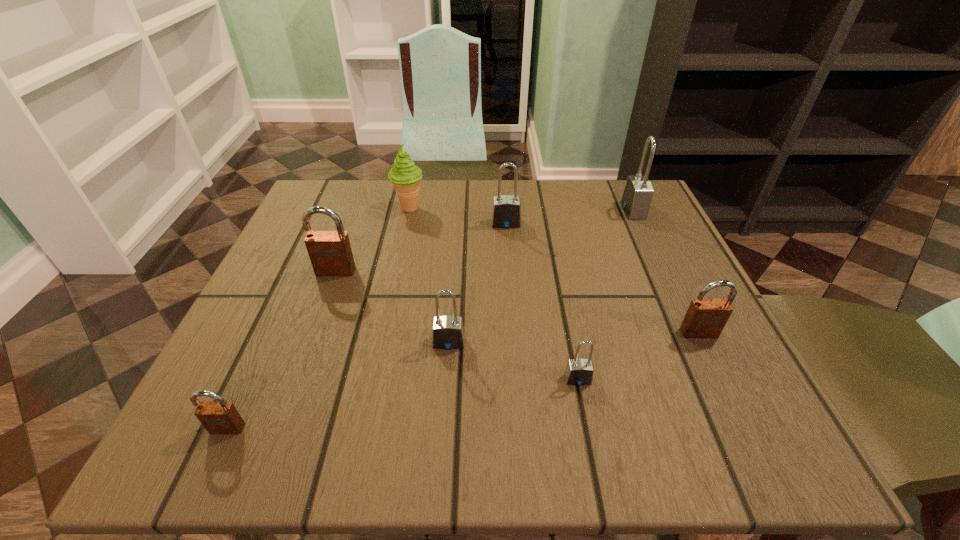
In the image, there is a desktop. Where is `vacant space at the near edge`? This screenshot has height=540, width=960. vacant space at the near edge is located at coordinates (432, 422).

Where is `free space at the left edge`? This screenshot has height=540, width=960. free space at the left edge is located at coordinates (276, 375).

This screenshot has width=960, height=540. In the image, there is a desktop. Find the location of `vacant space at the right edge`. vacant space at the right edge is located at coordinates (623, 259).

Image resolution: width=960 pixels, height=540 pixels. Identify the location of vacant space at the far left corner of the desktop. (303, 212).

Locate an element on the screen. free space at the far right corner of the desktop is located at coordinates (x=628, y=220).

This screenshot has width=960, height=540. I want to click on vacant space at the near right corner, so click(x=708, y=427).

Locate an element on the screen. This screenshot has height=540, width=960. vacant space that's between the nearest padlock and the rightmost brown padlock is located at coordinates (463, 380).

This screenshot has width=960, height=540. In order to click on vacant area between the icecream and the second smallest gray padlock in this screenshot , I will do `click(429, 275)`.

I want to click on unoccupied position between the second biggest brown padlock and the fifth nearest object, so click(x=517, y=302).

Identify the location of free spot between the nearest brown padlock and the icecream. This screenshot has height=540, width=960. (318, 318).